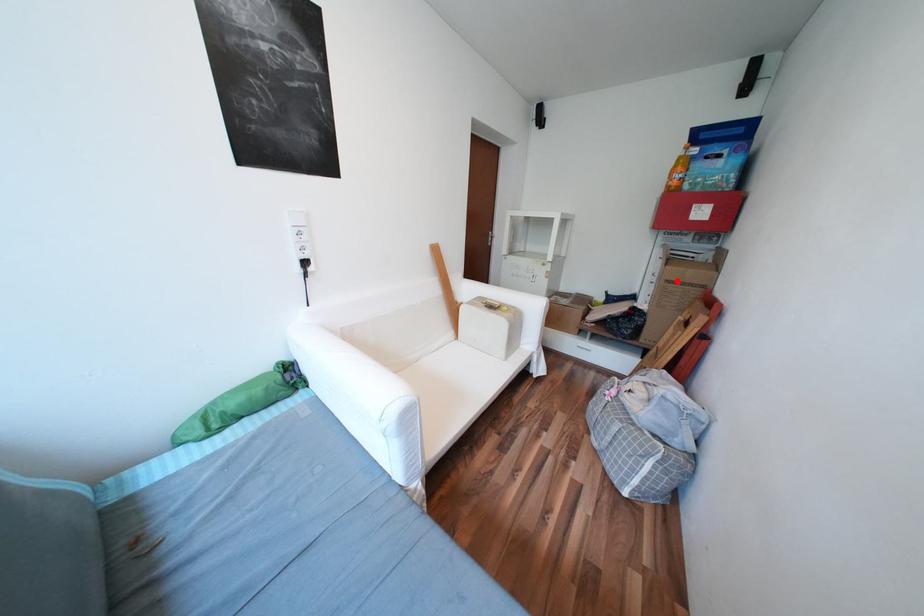
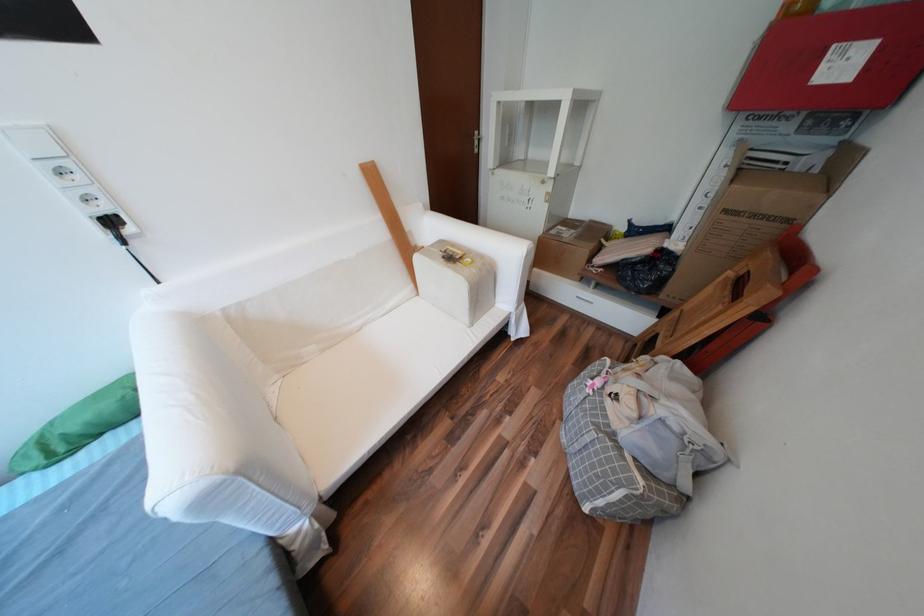
In the second image, find the point that corresponds to the highlighted location in the first image.

(736, 211)